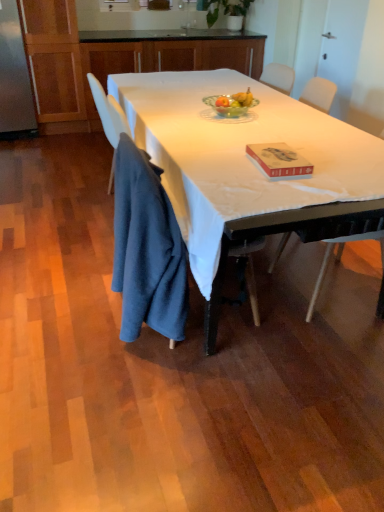
Find the location of `vacant area situated to the left side of dark blue fabric at lower left`. vacant area situated to the left side of dark blue fabric at lower left is located at coordinates (59, 316).